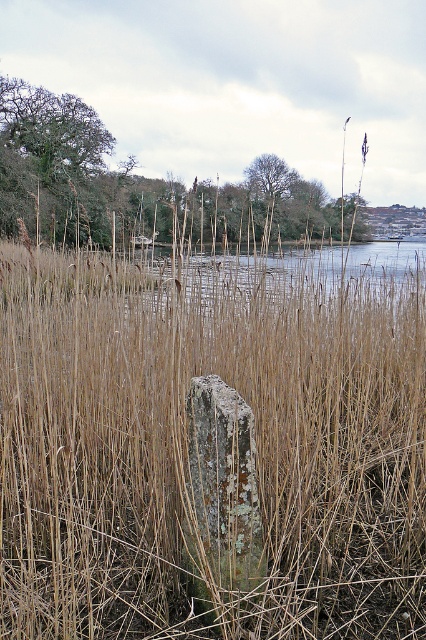
Question: Which object appears farthest from the camera in this image?

Choices:
 (A) brown dry grass at center
 (B) brown reeds at center

Answer: (B)

Question: Considering the real-world distances, which object is closest to the brown reeds at center?

Choices:
 (A) brown dry grass at center
 (B) lichen-covered stone at center

Answer: (B)

Question: Is brown reeds at center positioned before lichen-covered stone at center?

Choices:
 (A) yes
 (B) no

Answer: (A)

Question: Can you confirm if brown dry grass at center is positioned below lichen-covered stone at center?

Choices:
 (A) yes
 (B) no

Answer: (B)

Question: Which point appears farthest from the camera in this image?

Choices:
 (A) (268, 410)
 (B) (252, 296)

Answer: (B)

Question: Is brown reeds at center closer to camera compared to lichen-covered stone at center?

Choices:
 (A) yes
 (B) no

Answer: (A)